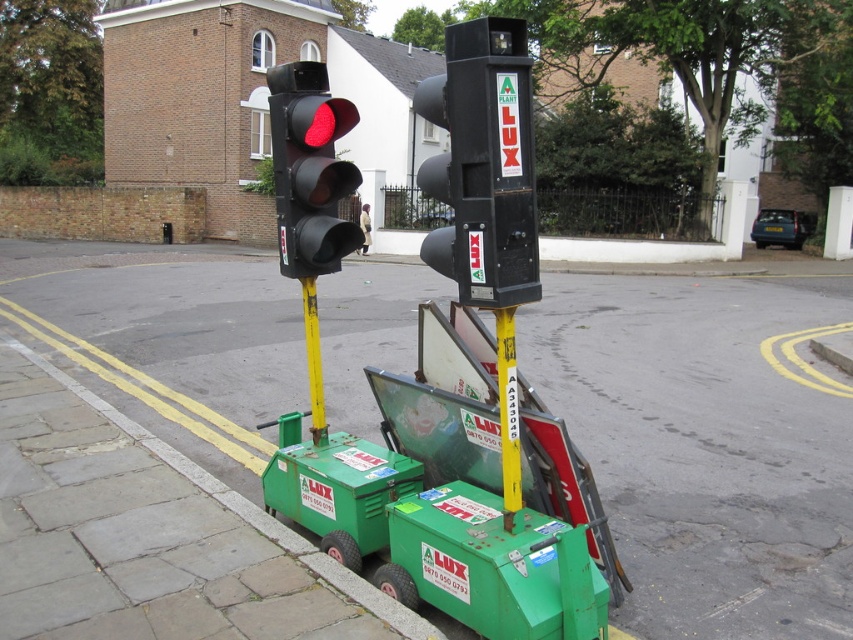
Question: Which of these objects is positioned closest to the black plastic traffic light at center?

Choices:
 (A) green plastic cart at lower center
 (B) black matte traffic light at left
 (C) yellow plastic pole at center
 (D) yellow metallic pole at center

Answer: (C)

Question: Which point appears farthest from the camera in this image?

Choices:
 (A) (273, 481)
 (B) (326, 243)
 (C) (305, 348)

Answer: (C)

Question: Does green plastic cart at lower center come behind yellow plastic pole at center?

Choices:
 (A) no
 (B) yes

Answer: (B)

Question: Can you confirm if black matte traffic light at left is positioned to the left of yellow plastic pole at center?

Choices:
 (A) no
 (B) yes

Answer: (B)

Question: Based on their relative distances, which object is farther from the yellow plastic pole at center?

Choices:
 (A) black matte traffic light at left
 (B) yellow metallic pole at center
 (C) green plastic cart at lower center

Answer: (B)

Question: Is black matte traffic light at left positioned in front of yellow plastic pole at center?

Choices:
 (A) no
 (B) yes

Answer: (A)